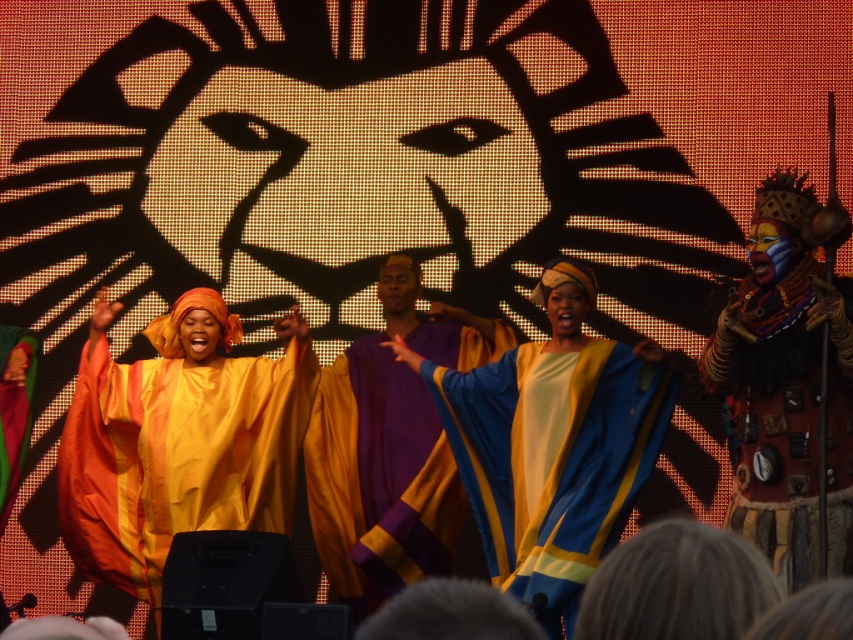
You are a stagehand preparing to place a 1.2 meter wide prop behind the performers. You see the silky yellow robe at center and the purple satin robe at center. Which robe should you consider the width of to ensure the prop fits?

The silky yellow robe at center might be wider than the purple satin robe at center, so you should consider the width of the silky yellow robe at center to ensure the prop fits appropriately.

You are a photographer at the back of the stage and want to capture both the matte yellow robe at center and the purple satin robe at center in a single shot. Which robe should you adjust your camera focus to first to ensure both are in frame?

The matte yellow robe at center is to the left of the purple satin robe at center, so you should focus on the purple satin robe at center first to ensure both are in frame.